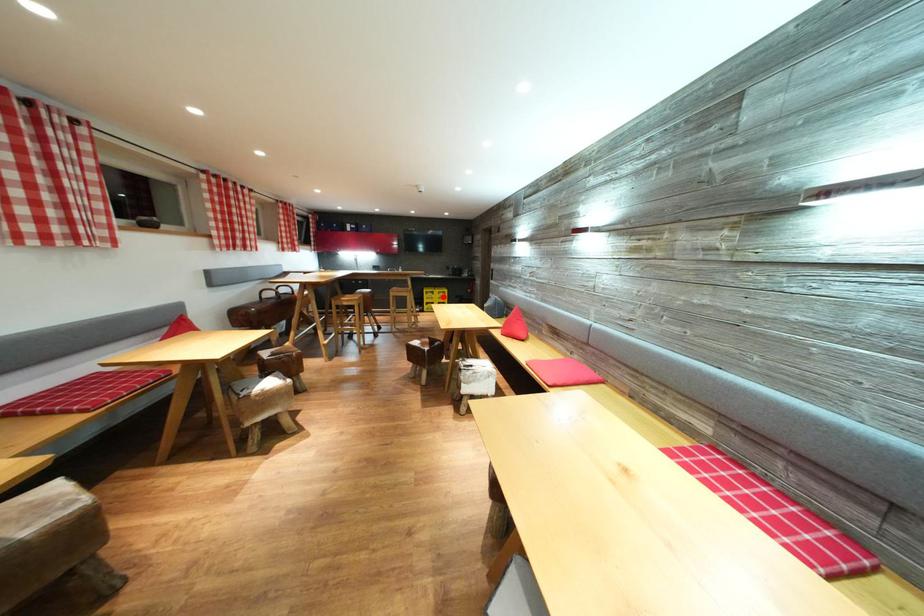
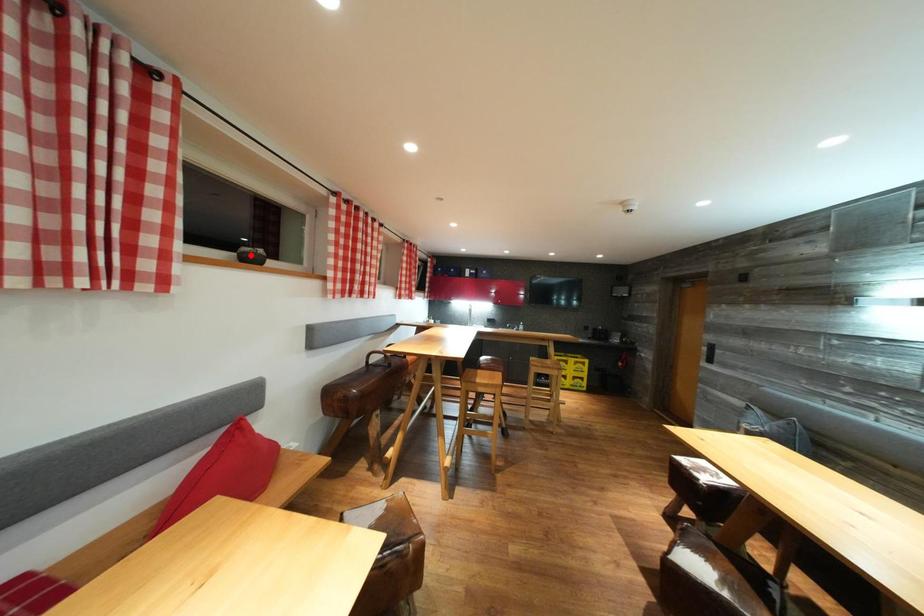
I am providing you with two images of the same scene from different viewpoints. A red point is marked on the first image and another point is marked on the second image. Do the highlighted points in image1 and image2 indicate the same real-world spot?

No